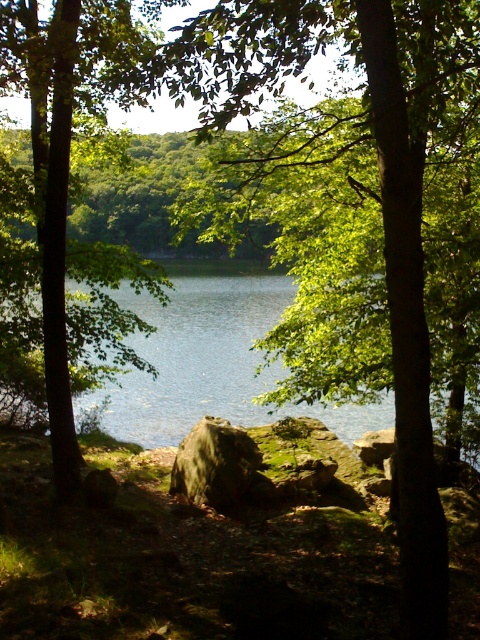
Can you confirm if green water at center is thinner than green mossy rock at center?

Incorrect, green water at center's width is not less than green mossy rock at center's.

Between green water at center and green mossy rock at center, which one appears on the left side from the viewer's perspective?

Positioned to the left is green mossy rock at center.

Which is behind, point (238, 416) or point (226, 422)?

Positioned behind is point (238, 416).

The height and width of the screenshot is (640, 480). I want to click on green water at center, so click(211, 360).

Is green leafy tree at left to the right of green water at center from the viewer's perspective?

No, green leafy tree at left is not to the right of green water at center.

Does green leafy tree at left have a greater width compared to green water at center?

No, green leafy tree at left is not wider than green water at center.

Identify the location of green leafy tree at left. (67, 202).

The width and height of the screenshot is (480, 640). What are the coordinates of `green leafy tree at left` in the screenshot? It's located at (67, 202).

Between green leafy tree at center and green mossy rock at center, which one is positioned lower?

green mossy rock at center is below.

Between point (320, 163) and point (215, 476), which one is positioned in front?

Point (320, 163)

Identify the location of green leafy tree at center. The width and height of the screenshot is (480, 640). (358, 216).